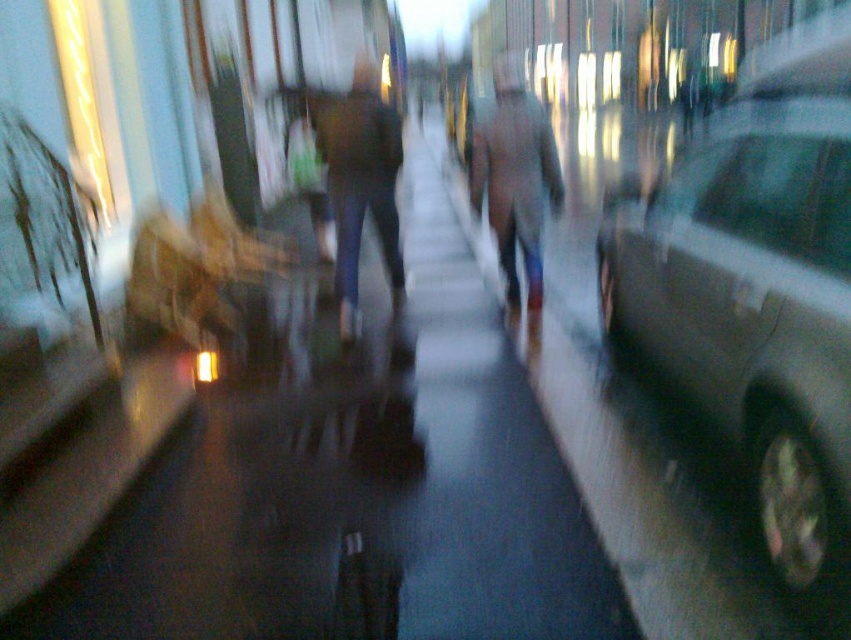
Based on the scene description, where is the dark asphalt sidewalk at center located in terms of its 2D coordinates?

The dark asphalt sidewalk at center is located at the 2D coordinates point [353,481].

You are standing in the twilight scene and want to place a small decorative item between the two points, point (758,220) and point (355,275). Which point should you stand closer to ensure the item is centered between them?

To center the item between point (758,220) and point (355,275), you should stand closer to point (355,275) because it is farther from the viewer, balancing the distance from both points.

You are a delivery person who needs to cross the street from the metallic silver car at right to the gray wool coat at center. The road is 6 meters wide. Can you safely cross without stepping into the road?

The distance between the metallic silver car at right and the gray wool coat at center is 6.22 meters. Since the road is 6 meters wide, you can safely cross by staying within the 6 meters width, but you must ensure that the extra 0.22 meters is accounted for to avoid the road.